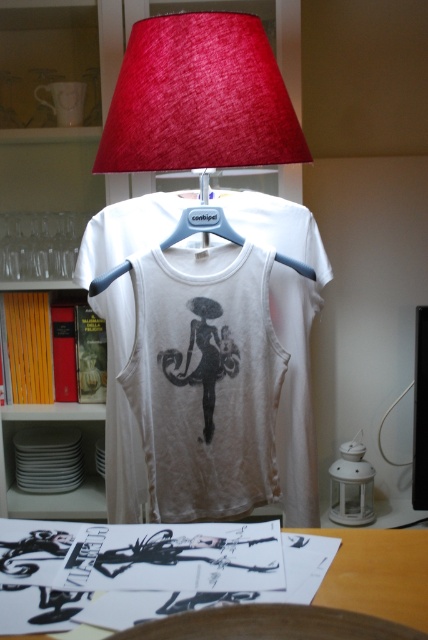
Question: Where is white cotton tank top at center located in relation to white matte lantern at lower right in the image?

Choices:
 (A) above
 (B) below

Answer: (A)

Question: Which of the following is the farthest from the observer?

Choices:
 (A) (249, 256)
 (B) (335, 516)

Answer: (B)

Question: Which object appears closest to the camera in this image?

Choices:
 (A) yellow wood bookshelf at upper left
 (B) textured red lampshade at upper center
 (C) wooden table at lower center
 (D) blue plastic hanger at center

Answer: (C)

Question: Observing the image, what is the correct spatial positioning of white cotton tank top at center in reference to white matte lantern at lower right?

Choices:
 (A) right
 (B) left

Answer: (B)

Question: Is the position of wooden table at lower center more distant than that of blue plastic hanger at center?

Choices:
 (A) no
 (B) yes

Answer: (A)

Question: Which object is the closest to the yellow wood bookshelf at upper left?

Choices:
 (A) wooden table at lower center
 (B) blue plastic hanger at center
 (C) white matte lantern at lower right
 (D) textured red lampshade at upper center

Answer: (D)